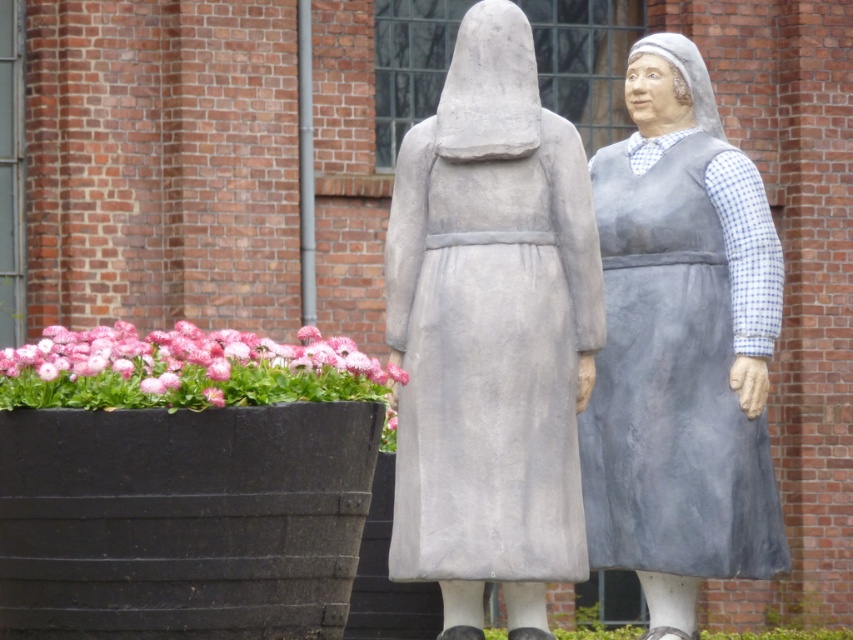
Can you confirm if gray stone statue at center is bigger than gray fabric dress at center?

Yes.

Who is shorter, gray stone statue at center or gray fabric dress at center?

Standing shorter between the two is gray fabric dress at center.

Who is more forward, (x=450, y=536) or (x=596, y=429)?

Positioned in front is point (x=450, y=536).

The width and height of the screenshot is (853, 640). What are the coordinates of `gray stone statue at center` in the screenshot? It's located at (491, 333).

Is point (735, 509) farther from camera compared to point (213, 392)?

Yes, it is.

This screenshot has width=853, height=640. Find the location of `gray fabric dress at center`. gray fabric dress at center is located at coordinates (671, 385).

Looking at this image, which is above, gray stone statue at center or pink fabric flowers at lower left?

gray stone statue at center is higher up.

Who is taller, gray stone statue at center or pink fabric flowers at lower left?

gray stone statue at center is taller.

Who is more distant from viewer, (404, 538) or (251, 387)?

The point (404, 538) is behind.

Identify the location of gray stone statue at center. (491, 333).